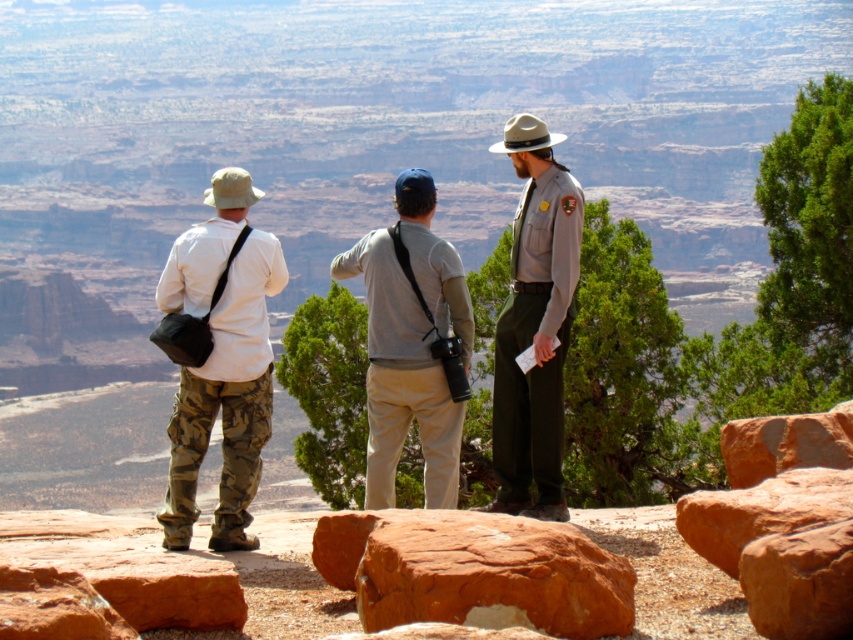
You are standing at the overlook and want to walk from the point marked as point (x=550, y=547) to the point marked as point (x=358, y=269). Which direction should you move to get closer to your destination?

To move from point (x=550, y=547) to point (x=358, y=269), you should move backward since point (x=550, y=547) is in front of point (x=358, y=269).